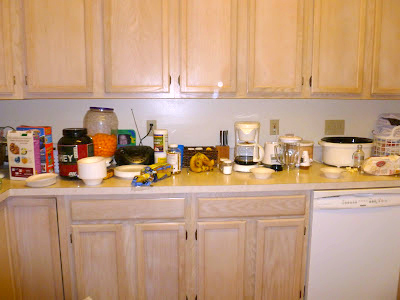
Where is `dishwasher`? The height and width of the screenshot is (300, 400). dishwasher is located at coordinates (365, 230).